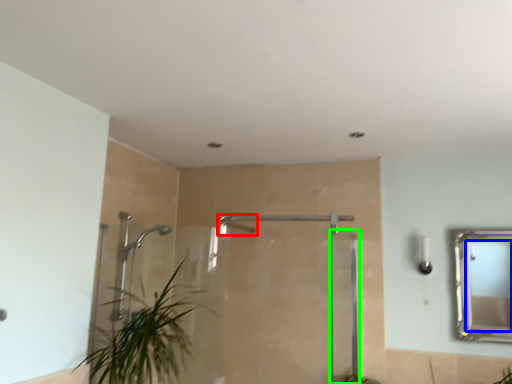
Question: Based on their relative distances, which object is farther from shower (highlighted by a red box)? Choose from mirror (highlighted by a blue box) and screen door (highlighted by a green box).

Choices:
 (A) mirror
 (B) screen door

Answer: (A)